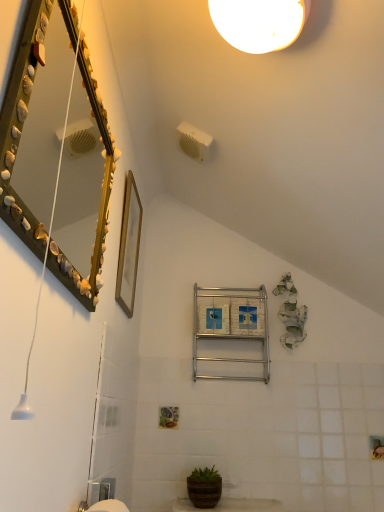
Question: Is wooden picture frame at upper center looking in the opposite direction of silver metallic towel rack at center?

Choices:
 (A) yes
 (B) no

Answer: (B)

Question: Is the surface of wooden picture frame at upper center in direct contact with silver metallic towel rack at center?

Choices:
 (A) no
 (B) yes

Answer: (A)

Question: Does wooden picture frame at upper center have a greater width compared to silver metallic towel rack at center?

Choices:
 (A) no
 (B) yes

Answer: (A)

Question: Is wooden picture frame at upper center outside of silver metallic towel rack at center?

Choices:
 (A) no
 (B) yes

Answer: (B)

Question: Can you confirm if wooden picture frame at upper center is shorter than silver metallic towel rack at center?

Choices:
 (A) yes
 (B) no

Answer: (B)

Question: Is wooden picture frame at upper center taller than silver metallic towel rack at center?

Choices:
 (A) yes
 (B) no

Answer: (A)

Question: Does silver metallic towel rack at center have a smaller size compared to seashell-covered mirror at upper left?

Choices:
 (A) yes
 (B) no

Answer: (B)

Question: Considering the relative sizes of silver metallic towel rack at center and seashell-covered mirror at upper left in the image provided, is silver metallic towel rack at center shorter than seashell-covered mirror at upper left?

Choices:
 (A) no
 (B) yes

Answer: (B)

Question: Is silver metallic towel rack at center taller than seashell-covered mirror at upper left?

Choices:
 (A) no
 (B) yes

Answer: (A)

Question: Can seashell-covered mirror at upper left be found inside silver metallic towel rack at center?

Choices:
 (A) no
 (B) yes

Answer: (A)

Question: Is silver metallic towel rack at center thinner than seashell-covered mirror at upper left?

Choices:
 (A) no
 (B) yes

Answer: (A)

Question: Does silver metallic towel rack at center appear on the right side of seashell-covered mirror at upper left?

Choices:
 (A) no
 (B) yes

Answer: (B)

Question: From the image's perspective, is wooden picture frame at upper center on seashell-covered mirror at upper left?

Choices:
 (A) no
 (B) yes

Answer: (A)